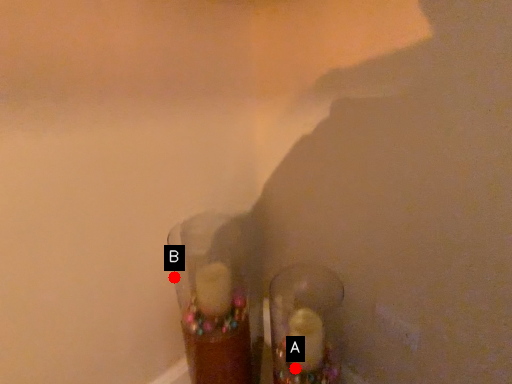
Question: Two points are circled on the image, labeled by A and B beside each circle. Among these points, which one is nearest to the camera?

Choices:
 (A) A is closer
 (B) B is closer

Answer: (A)